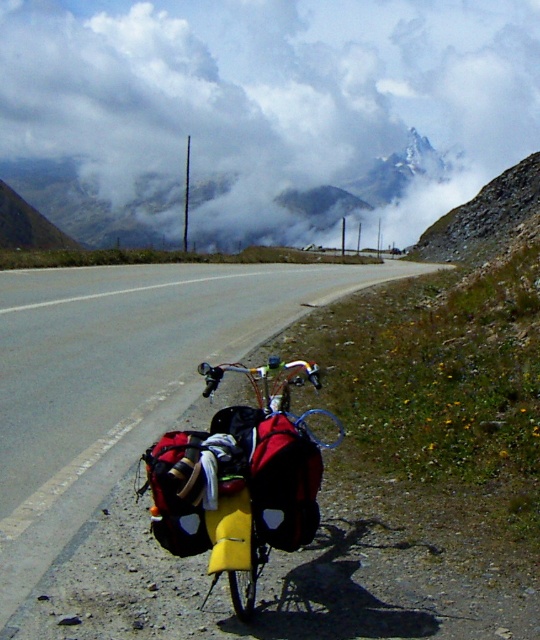
Which is more to the left, cloudy sky at upper center or asphalt road at center?

Positioned to the left is cloudy sky at upper center.

What do you see at coordinates (262, 113) in the screenshot? I see `cloudy sky at upper center` at bounding box center [262, 113].

Which is behind, point (504, 88) or point (70, 488)?

Point (504, 88)

Locate an element on the screen. cloudy sky at upper center is located at coordinates (262, 113).

Is asphalt road at center smaller than yellow matte bag at center?

No.

Is asphalt road at center closer to the viewer compared to yellow matte bag at center?

No.

Between point (82, 342) and point (268, 486), which one is positioned behind?

The point (82, 342) is behind.

I want to click on asphalt road at center, so click(x=122, y=378).

In the scene shown: Does cloudy sky at upper center appear over yellow matte bag at center?

Indeed, cloudy sky at upper center is positioned over yellow matte bag at center.

Is cloudy sky at upper center below yellow matte bag at center?

No, cloudy sky at upper center is not below yellow matte bag at center.

Does point (328, 61) come in front of point (294, 461)?

No.

Where is `cloudy sky at upper center`? cloudy sky at upper center is located at coordinates (262, 113).